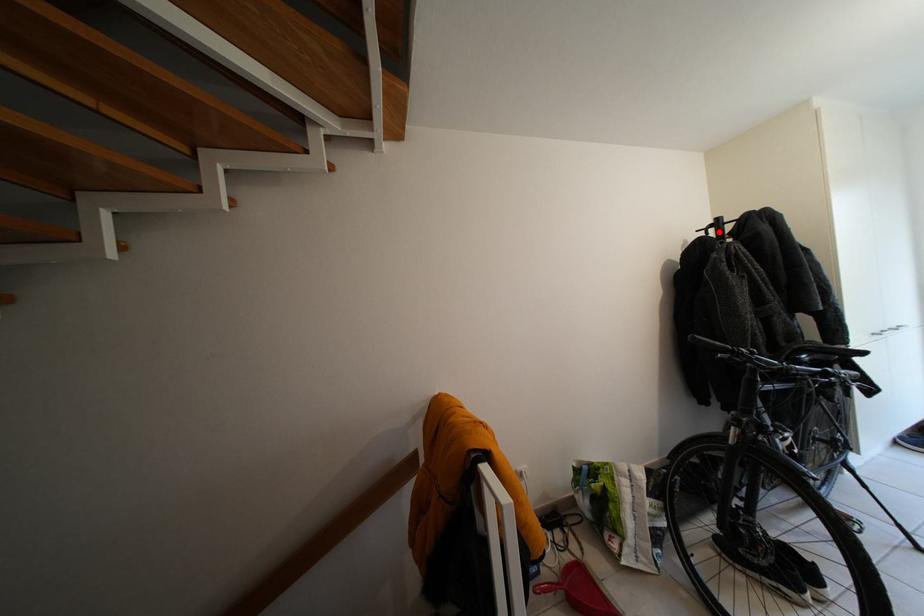
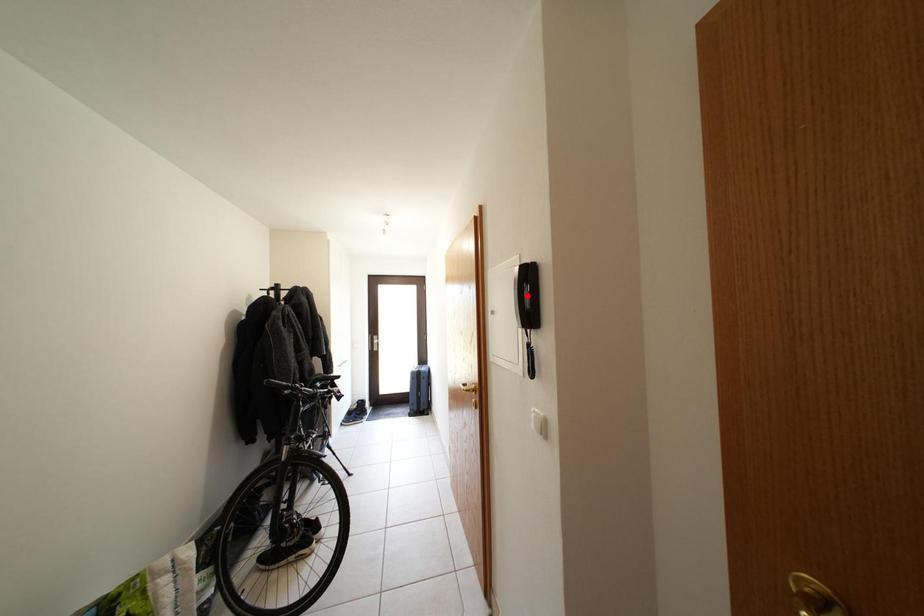
I am providing you with two images of the same scene from different viewpoints. A red point is marked on the first image and another point is marked on the second image. Is the marked point in image1 the same physical position as the marked point in image2?

No